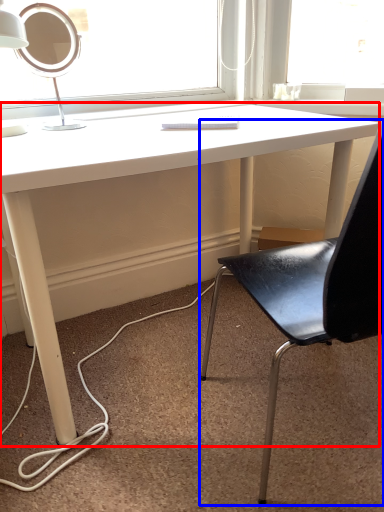
Question: Which object is further to the camera taking this photo, desk (highlighted by a red box) or chair (highlighted by a blue box)?

Choices:
 (A) desk
 (B) chair

Answer: (A)